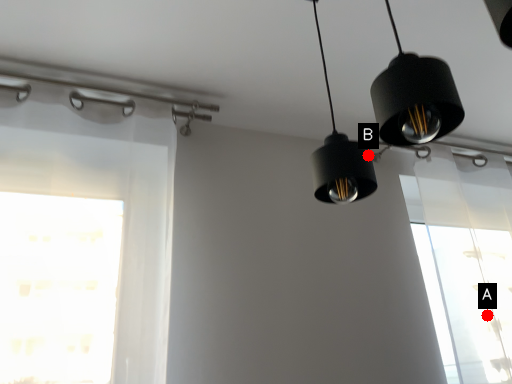
Question: Two points are circled on the image, labeled by A and B beside each circle. Which point is closer to the camera?

Choices:
 (A) A is closer
 (B) B is closer

Answer: (B)